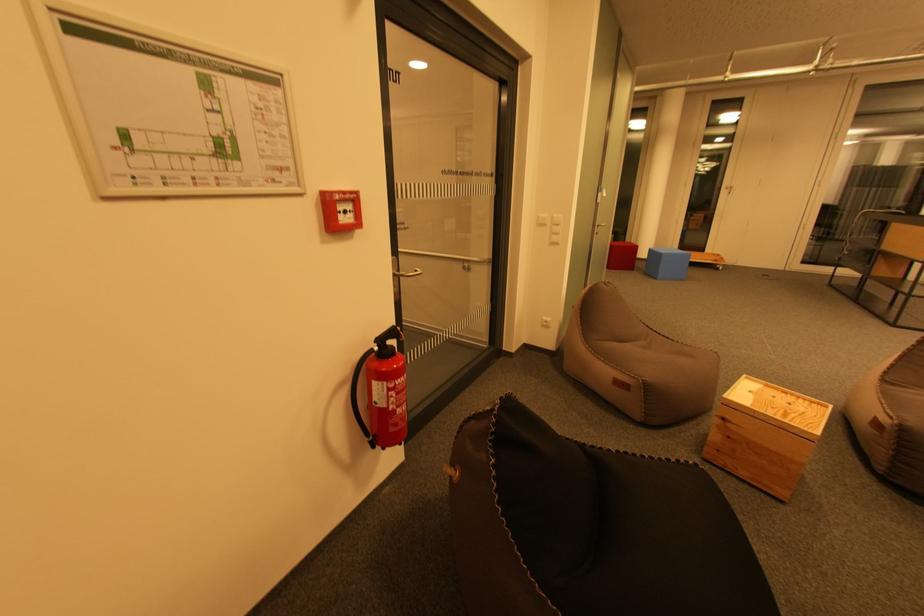
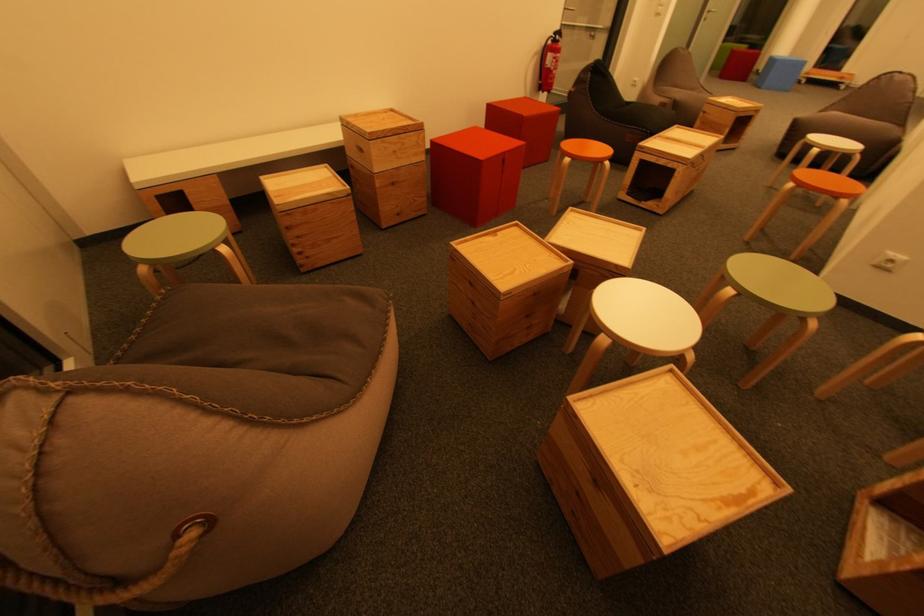
Question: What movement of the cameraman would produce the second image?

Choices:
 (A) Left
 (B) Right
 (C) Forward
 (D) Backward

Answer: (D)